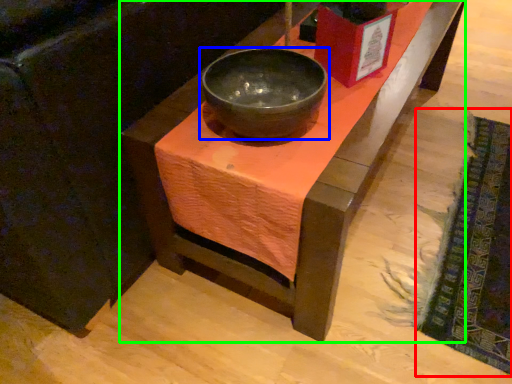
Question: Based on their relative distances, which object is nearer to mat (highlighted by a red box)? Choose from bowl (highlighted by a blue box) and table (highlighted by a green box).

Choices:
 (A) bowl
 (B) table

Answer: (B)